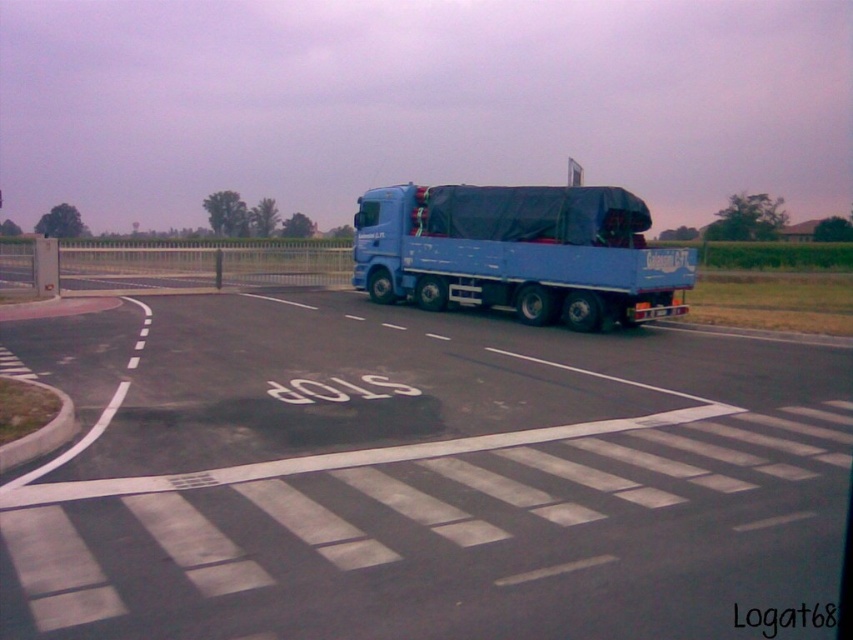
You are driving a car and need to pass through the intersection. There is a blue rubber truck at center and a blue matte trailer truck at center in your path. Which one should you avoid first?

You should avoid the blue rubber truck at center first because it is closer to you than the blue matte trailer truck at center.